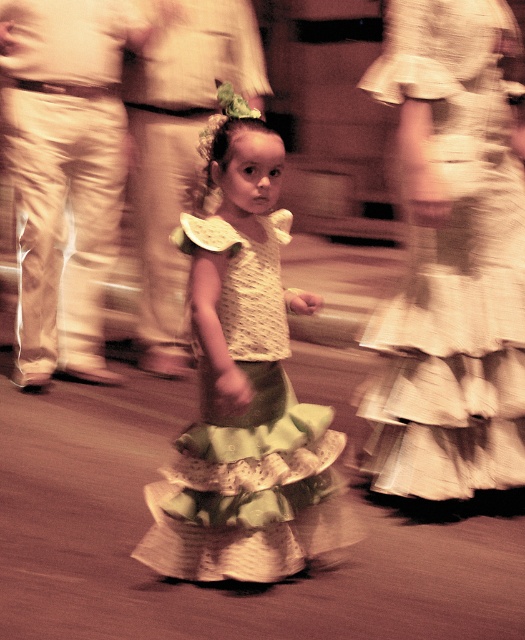
Based on the scene description, which object is positioned higher in the image between the green ruffled skirt at center and the green textured skirt at center?

The green ruffled skirt at center is positioned higher than the green textured skirt at center according to the description.

You are a photographer trying to focus on the green ruffled skirt at center in the image. What are the coordinates where you should aim your camera to capture it accurately?

The green ruffled skirt at center is located at coordinates point (x=450, y=257). Aim your camera there to capture it accurately.

You are a photographer who just took a picture of a girl in a green skirt. You notice two green skirts in the image labeled as green ruffled skirt at center and green textured skirt at center. Which one is positioned more to the right side of the image?

The green ruffled skirt at center is positioned more to the right side of the image compared to the green textured skirt at center.